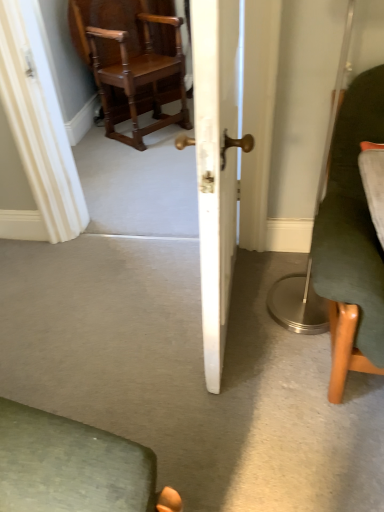
Question: From a real-world perspective, relative to polished wood chair at upper left, positioned as the 1th chair in left-to-right order, is white wood door at center vertically above or below?

Choices:
 (A) above
 (B) below

Answer: (A)

Question: Would you say white wood door at center is to the left or to the right of polished wood chair at upper left, the first chair when ordered from back to front, in the picture?

Choices:
 (A) right
 (B) left

Answer: (A)

Question: Based on their relative distances, which object is farther from the white wood door at center?

Choices:
 (A) dark green fabric chair at right, the 2th chair in the top-to-bottom sequence
 (B) polished wood chair at upper left, arranged as the 2th chair when ordered from the bottom

Answer: (B)

Question: Considering the real-world distances, which object is farthest from the white wood door at center?

Choices:
 (A) polished wood chair at upper left, the second chair when ordered from front to back
 (B) dark green fabric chair at right, the 1th chair viewed from the front

Answer: (A)